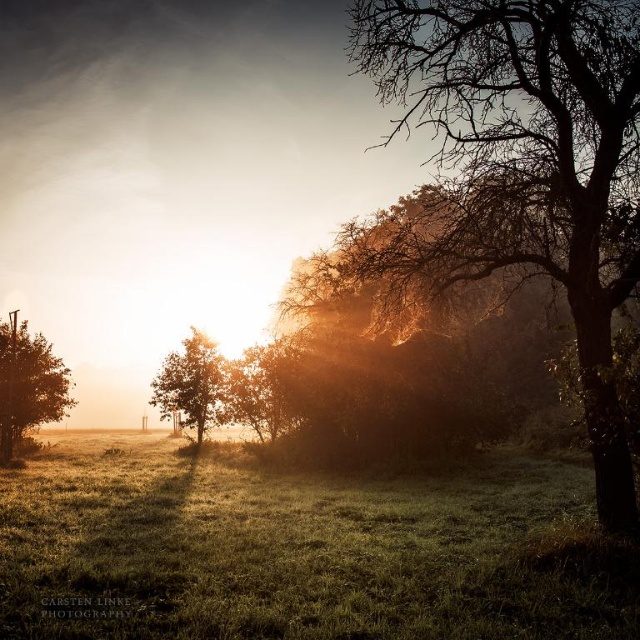
Question: Can you confirm if brown textured tree at right is smaller than green matte tree at center?

Choices:
 (A) no
 (B) yes

Answer: (A)

Question: Among these points, which one is farthest from the camera?

Choices:
 (A) (60, 419)
 (B) (157, 388)

Answer: (A)

Question: Which object is positioned closest to the brown textured tree at right?

Choices:
 (A) green grassy at lower center
 (B) green matte tree at center
 (C) green matte tree at left

Answer: (A)

Question: Where is brown textured tree at right located in relation to green matte tree at left in the image?

Choices:
 (A) right
 (B) left

Answer: (A)

Question: Among these objects, which one is nearest to the camera?

Choices:
 (A) green grassy at lower center
 (B) green matte tree at left
 (C) green matte tree at center
 (D) brown textured tree at right

Answer: (A)

Question: Observing the image, what is the correct spatial positioning of brown textured tree at right in reference to green matte tree at left?

Choices:
 (A) below
 (B) above

Answer: (B)